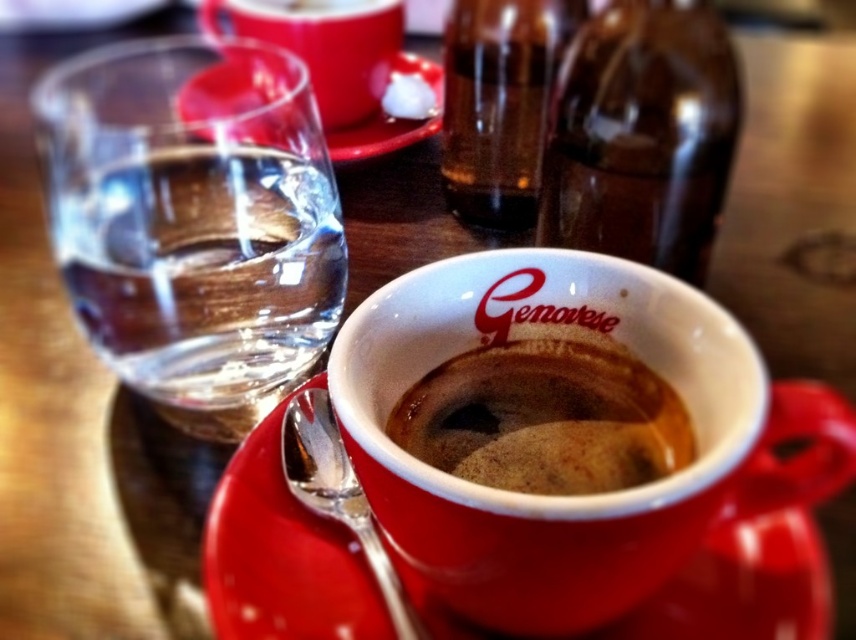
Which is more to the right, red glossy saucer at center or translucent glass bottle at center?

Positioned to the right is red glossy saucer at center.

Is point (388, 538) less distant than point (498, 193)?

Yes.

Where is `red glossy saucer at center`? The image size is (856, 640). red glossy saucer at center is located at coordinates (308, 556).

Between brown glass bottle at upper center and matte ceramic saucer at upper center, which one has more height?

matte ceramic saucer at upper center

Between brown glass bottle at upper center and matte ceramic saucer at upper center, which one appears on the right side from the viewer's perspective?

brown glass bottle at upper center is more to the right.

Image resolution: width=856 pixels, height=640 pixels. In order to click on brown glass bottle at upper center in this screenshot , I will do `click(642, 134)`.

Is red glossy saucer at center bigger than brown matte coffee at center?

Yes.

Is point (248, 490) closer to viewer compared to point (452, 422)?

No, (248, 490) is behind (452, 422).

Identify the location of red glossy saucer at center. (308, 556).